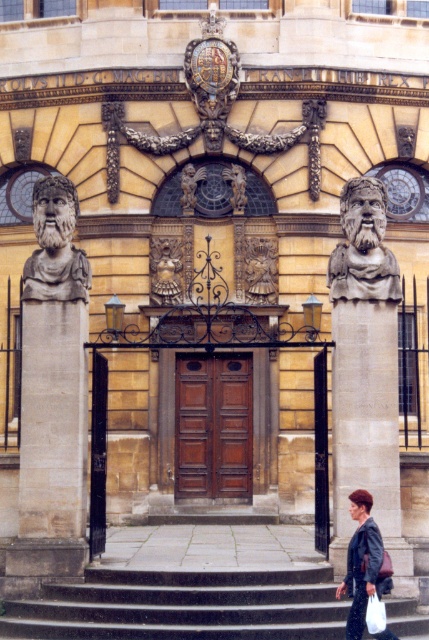
You are a visitor approaching the entrance of the grand building. You see the polished stone bust at left and the gold metallic statue at center. Which object is closer to you as you approach the entrance?

The polished stone bust at left is closer to you because it is positioned in front of the gold metallic statue at center.

You are a delivery person carrying a large package that requires placing it exactly between the dark gray leather jacket at lower right and the polished bronze statue at center. Given that the distance between them is 27.07 meters, can you estimate the midpoint where you should place the package?

The midpoint between the dark gray leather jacket at lower right and the polished bronze statue at center would be at 13.535 meters from either object, so place the package there.

You are standing at the entrance of the grand building and want to take a photo that includes both the polished stone bust at left and the gold metallic statue at center. Given that your camera can capture a maximum distance of 15 meters between objects, will you be able to frame both in the same shot?

The polished stone bust at left is 14.70 meters away from the gold metallic statue at center. Since the distance between them is less than the camera maximum of 15 meters, you can frame both in the same shot.